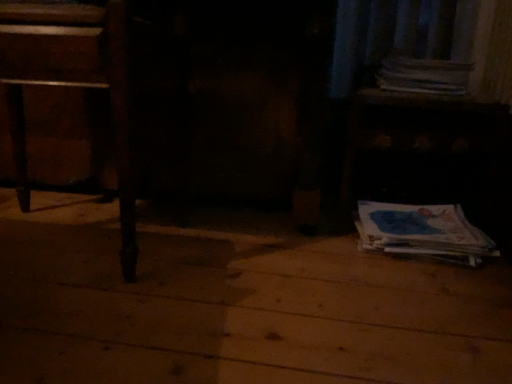
Question: Does white paper at upper right, the 1th paperback book positioned from the top, touch wooden table at lower right?

Choices:
 (A) no
 (B) yes

Answer: (A)

Question: Is white paper at upper right, the 1th paperback book positioned from the top, taller than wooden table at lower right?

Choices:
 (A) no
 (B) yes

Answer: (A)

Question: Does white paper at upper right, which appears as the 2th paperback book when ordered from the bottom, have a smaller size compared to wooden table at lower right?

Choices:
 (A) yes
 (B) no

Answer: (A)

Question: Is white paper at upper right, which appears as the 2th paperback book when ordered from the bottom, at the left side of wooden table at lower right?

Choices:
 (A) no
 (B) yes

Answer: (A)

Question: Is the depth of white paper at upper right, which appears as the 2th paperback book when ordered from the bottom, greater than that of wooden table at lower right?

Choices:
 (A) yes
 (B) no

Answer: (A)

Question: Relative to white paper at upper right, the 1th paperback book positioned from the top, is wooden table at lower right in front or behind?

Choices:
 (A) front
 (B) behind

Answer: (A)

Question: From a real-world perspective, is wooden table at lower right positioned above or below white paper at upper right, the 1th paperback book positioned from the top?

Choices:
 (A) above
 (B) below

Answer: (B)

Question: Based on their positions, is wooden table at lower right located to the left or right of white paper at upper right, which appears as the 2th paperback book when ordered from the bottom?

Choices:
 (A) left
 (B) right

Answer: (A)

Question: In terms of width, does wooden table at lower right look wider or thinner when compared to white paper at upper right, the 1th paperback book positioned from the top?

Choices:
 (A) thin
 (B) wide

Answer: (B)

Question: Considering their positions, is blue paper at lower right, the second paperback book viewed from the top, located in front of or behind white paper at upper right, which appears as the 2th paperback book when ordered from the bottom?

Choices:
 (A) behind
 (B) front

Answer: (B)

Question: From the image's perspective, relative to white paper at upper right, the 1th paperback book positioned from the top, is blue paper at lower right, the second paperback book viewed from the top, above or below?

Choices:
 (A) above
 (B) below

Answer: (B)

Question: Choose the correct answer: Is blue paper at lower right, the second paperback book viewed from the top, inside white paper at upper right, the 1th paperback book positioned from the top, or outside it?

Choices:
 (A) outside
 (B) inside

Answer: (A)

Question: Considering the positions of blue paper at lower right, the second paperback book viewed from the top, and white paper at upper right, the 1th paperback book positioned from the top, in the image, is blue paper at lower right, the second paperback book viewed from the top, wider or thinner than white paper at upper right, the 1th paperback book positioned from the top,?

Choices:
 (A) thin
 (B) wide

Answer: (A)

Question: From the image's perspective, is wooden table at lower right located above or below wooden table at left?

Choices:
 (A) below
 (B) above

Answer: (B)

Question: Is point (352, 112) closer or farther from the camera than point (16, 28)?

Choices:
 (A) closer
 (B) farther

Answer: (B)